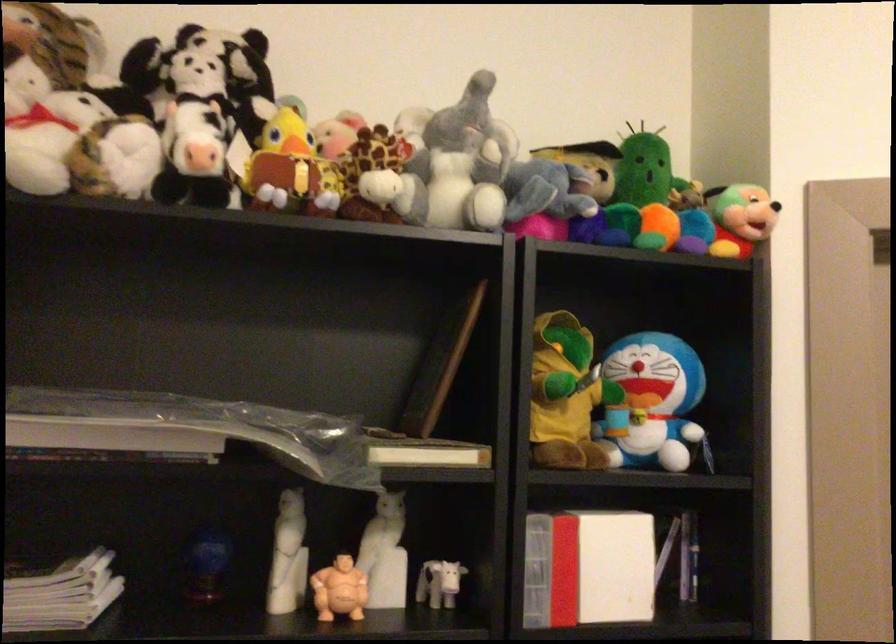
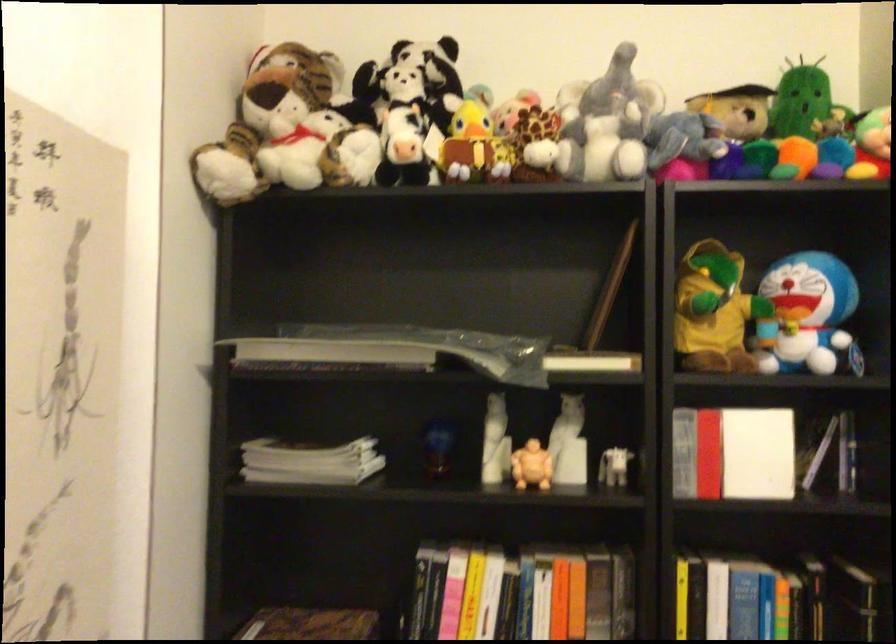
Where in the second image is the point corresponding to the point at 455,162 from the first image?

(607, 122)